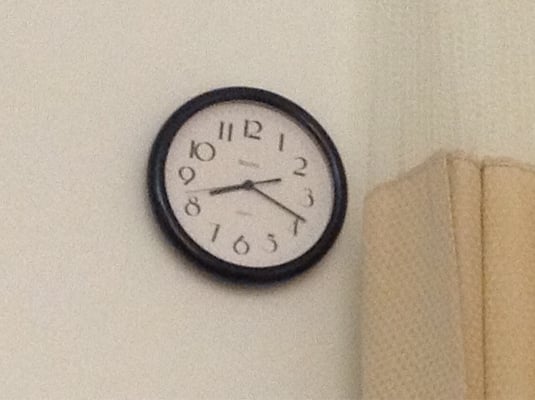
Identify the location of curtain / drape. The height and width of the screenshot is (400, 535). (406, 219).